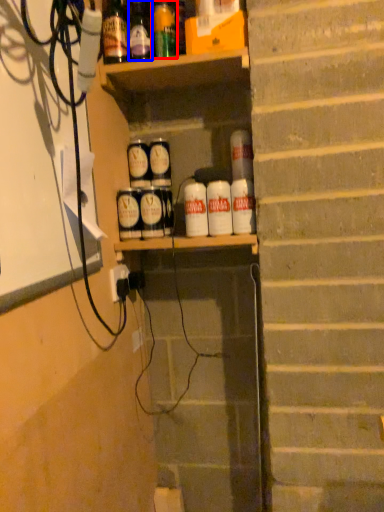
Question: Which of the following is the farthest to the observer, bottle (highlighted by a red box) or bottle (highlighted by a blue box)?

Choices:
 (A) bottle
 (B) bottle

Answer: (A)